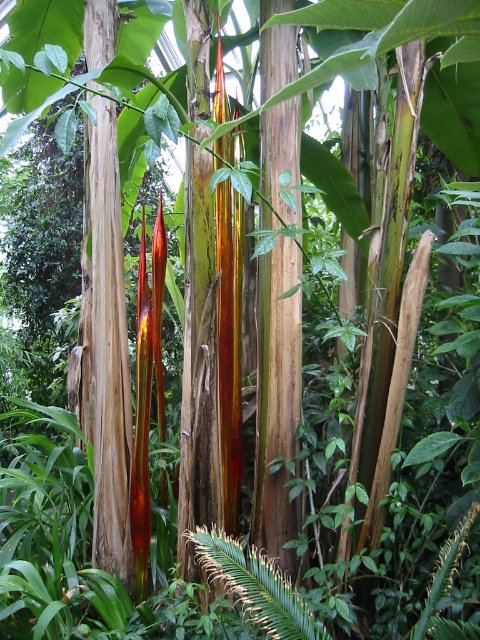
Looking at this image, can you confirm if smooth brown tree trunk at center is thinner than green leafy fern at center?

Indeed, smooth brown tree trunk at center has a lesser width compared to green leafy fern at center.

Does smooth brown tree trunk at center have a lesser height compared to green leafy fern at center?

Incorrect, smooth brown tree trunk at center's height does not fall short of green leafy fern at center's.

The height and width of the screenshot is (640, 480). What do you see at coordinates (106, 346) in the screenshot?
I see `smooth brown tree trunk at center` at bounding box center [106, 346].

Locate an element on the screen. The width and height of the screenshot is (480, 640). smooth brown tree trunk at center is located at coordinates (106, 346).